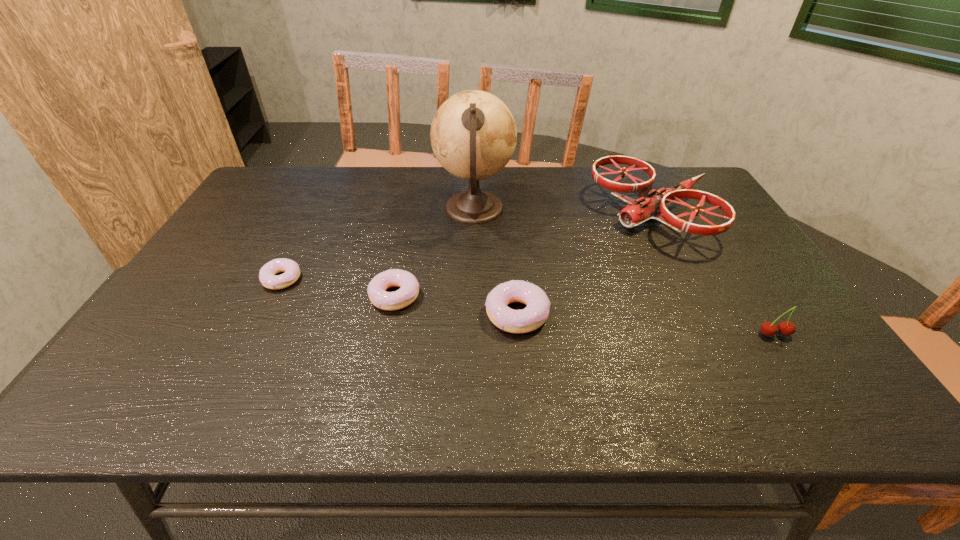
With all doughnuts evenly spaced, where should an extra doughnut be placed on the right to continue the pattern? Please point out a vacant space. Please provide its 2D coordinates. Your answer should be formatted as a tuple, i.e. [(x, y)], where the tuple contains the x and y coordinates of a point satisfying the conditions above.

[(651, 334)]